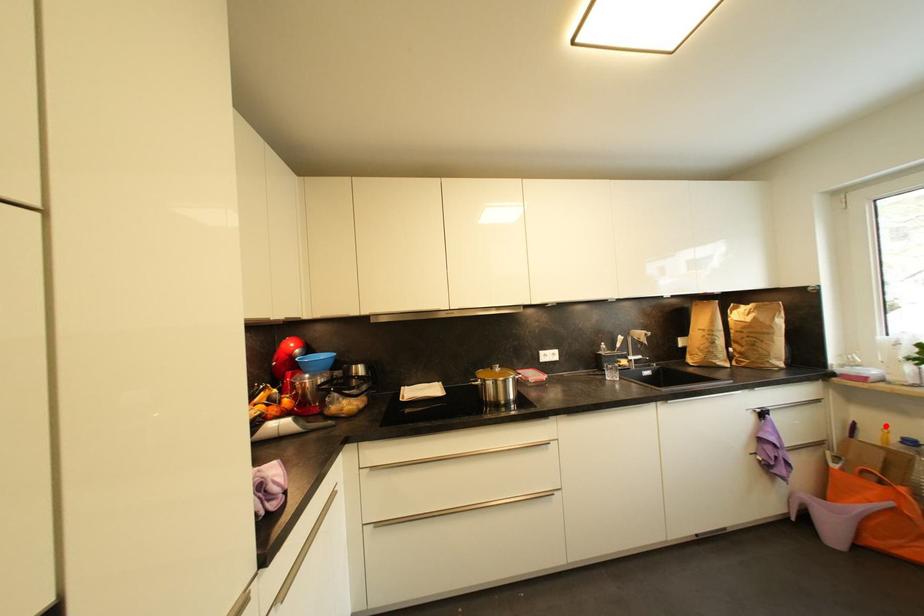
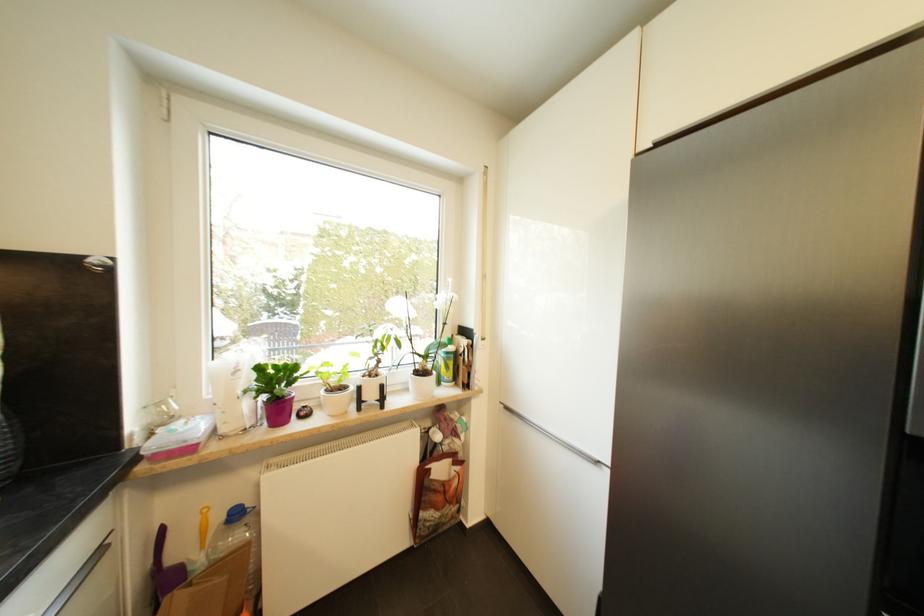
Question: I am providing you with two images of the same scene from different viewpoints. A red point is shown in image1. For the corresponding object point in image2, is it positioned nearer or farther from the camera?

Choices:
 (A) Nearer
 (B) Farther

Answer: (A)